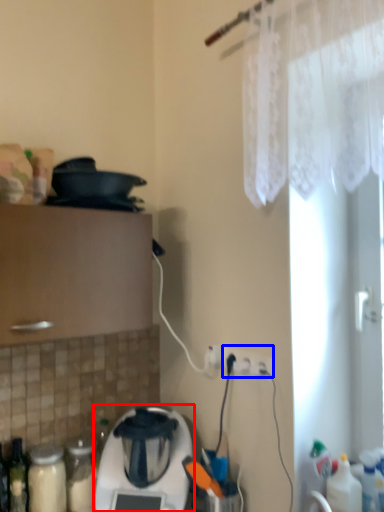
Question: Which of the following is the farthest to the observer, home appliance (highlighted by a red box) or electric outlet (highlighted by a blue box)?

Choices:
 (A) home appliance
 (B) electric outlet

Answer: (B)